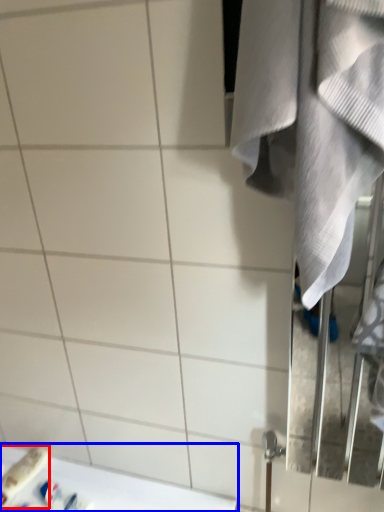
Question: Which of the following is the farthest to the observer, toiletry (highlighted by a red box) or counter top (highlighted by a blue box)?

Choices:
 (A) toiletry
 (B) counter top

Answer: (A)